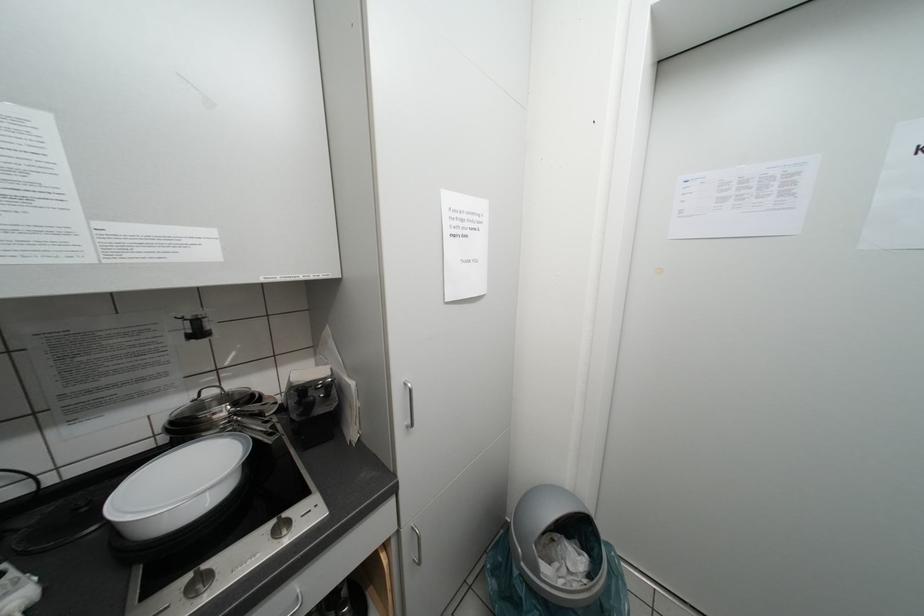
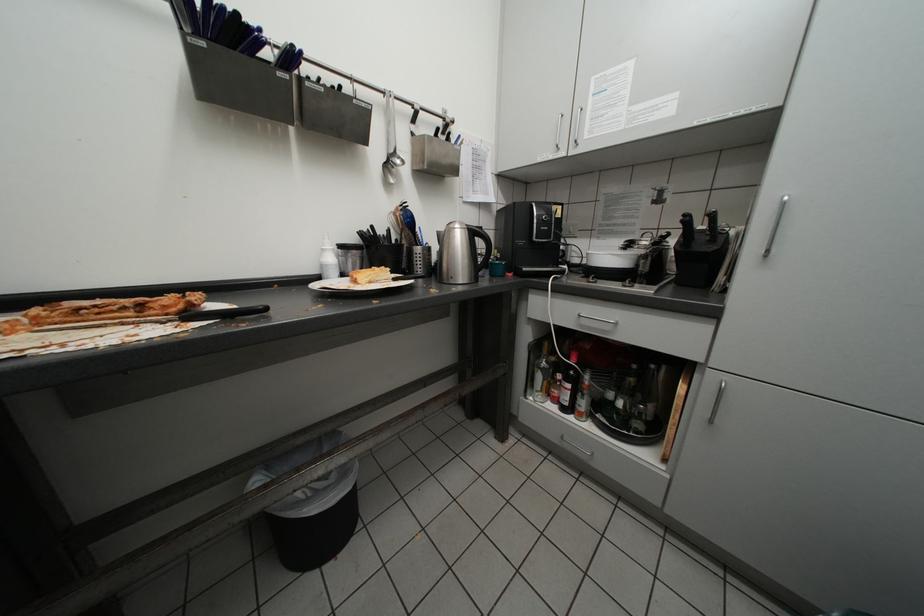
Based on the continuous images, in which direction is the camera rotating?

The camera's rotation is toward left-down.